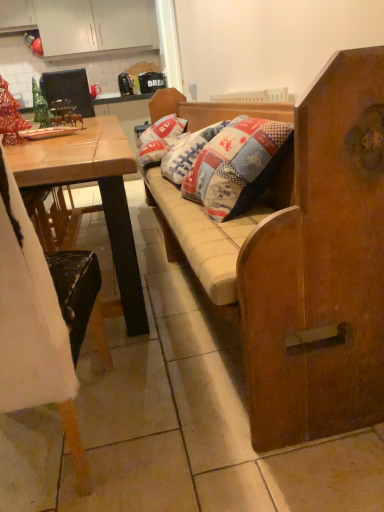
Question: Does wooden chair at left have a larger size compared to wooden desk at left?

Choices:
 (A) no
 (B) yes

Answer: (A)

Question: Is wooden chair at left wider than wooden desk at left?

Choices:
 (A) no
 (B) yes

Answer: (A)

Question: From the image's perspective, is wooden chair at left above wooden desk at left?

Choices:
 (A) no
 (B) yes

Answer: (A)

Question: Can you confirm if wooden chair at left is smaller than wooden desk at left?

Choices:
 (A) no
 (B) yes

Answer: (B)

Question: Would you consider wooden chair at left to be distant from wooden desk at left?

Choices:
 (A) yes
 (B) no

Answer: (B)

Question: From a real-world perspective, is wooden chair at left under wooden desk at left?

Choices:
 (A) yes
 (B) no

Answer: (B)

Question: Can you confirm if metallic black armchair at upper left is wider than metallic green ornament at upper left?

Choices:
 (A) yes
 (B) no

Answer: (A)

Question: From a real-world perspective, is metallic black armchair at upper left on metallic green ornament at upper left?

Choices:
 (A) yes
 (B) no

Answer: (A)

Question: From the image's perspective, is metallic black armchair at upper left on metallic green ornament at upper left?

Choices:
 (A) yes
 (B) no

Answer: (A)

Question: Does metallic black armchair at upper left come in front of metallic green ornament at upper left?

Choices:
 (A) no
 (B) yes

Answer: (A)

Question: Does metallic black armchair at upper left have a lesser width compared to metallic green ornament at upper left?

Choices:
 (A) no
 (B) yes

Answer: (A)

Question: Is there a large distance between metallic black armchair at upper left and metallic green ornament at upper left?

Choices:
 (A) yes
 (B) no

Answer: (B)

Question: Considering the relative sizes of patchwork fabric pillow at center and wooden cushioned bench at center in the image provided, is patchwork fabric pillow at center wider than wooden cushioned bench at center?

Choices:
 (A) no
 (B) yes

Answer: (A)